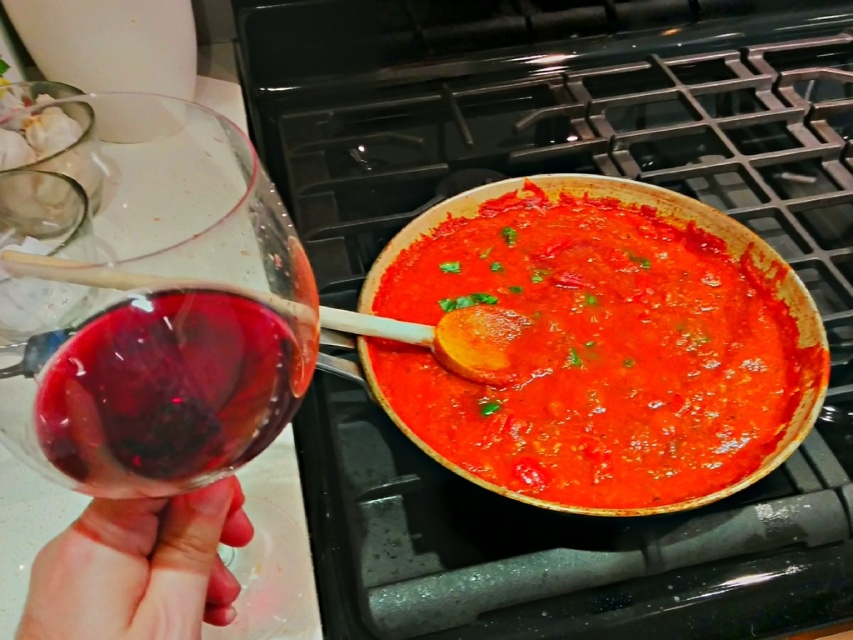
You are a chef preparing a dish and need to move the transparent glass at left to the black matte gas stove at upper center. What is the minimum distance you need to move it?

The minimum distance to move the transparent glass at left to the black matte gas stove at upper center is 27.00 centimeters.